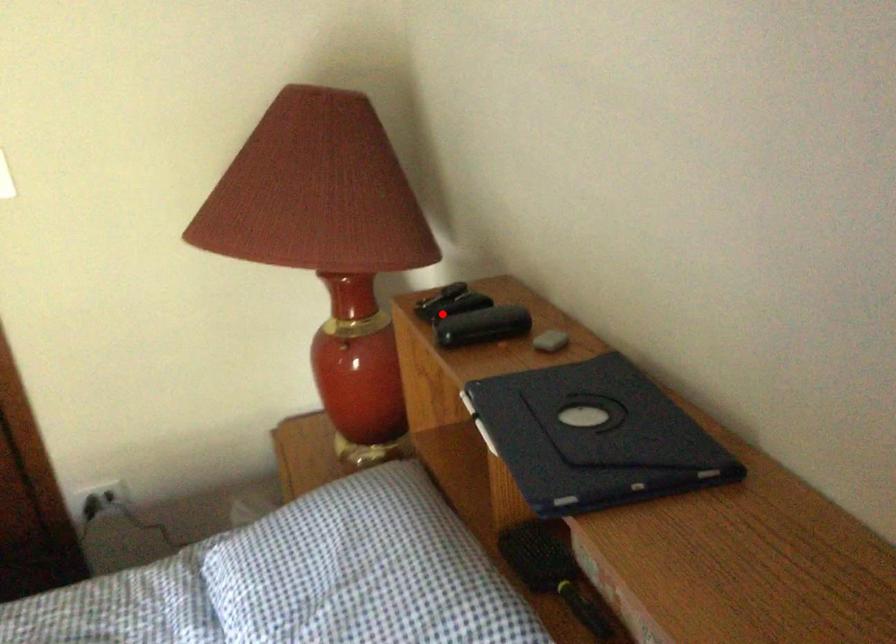
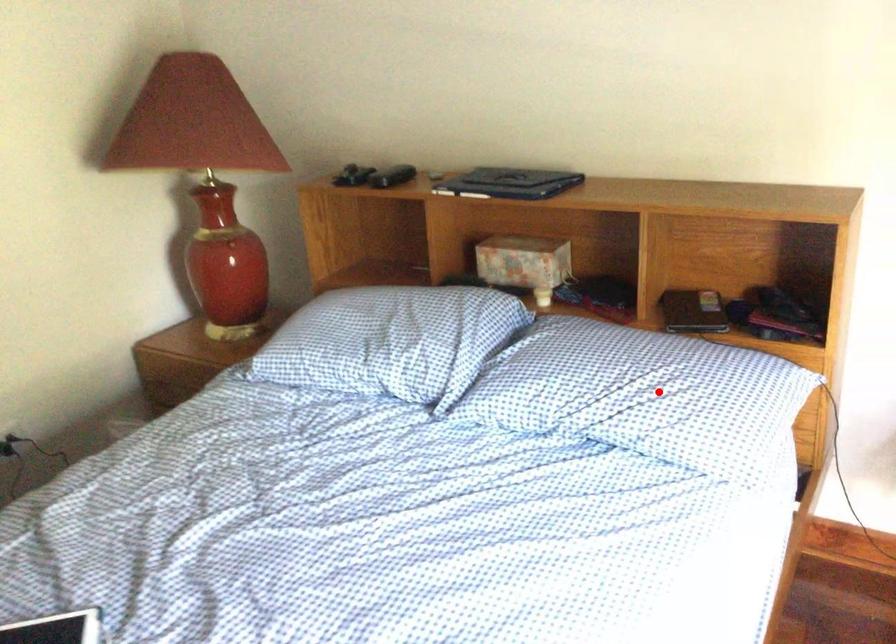
In the scene shown: I am providing you with two images of the same scene from different viewpoints. A red point is marked on the first image and another point is marked on the second image. Is the marked point in image1 the same physical position as the marked point in image2?

No